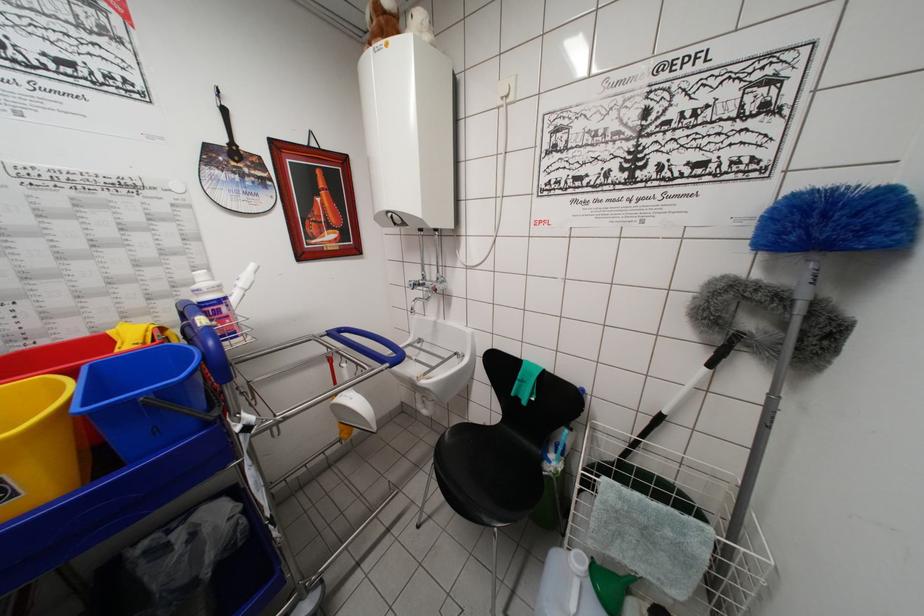
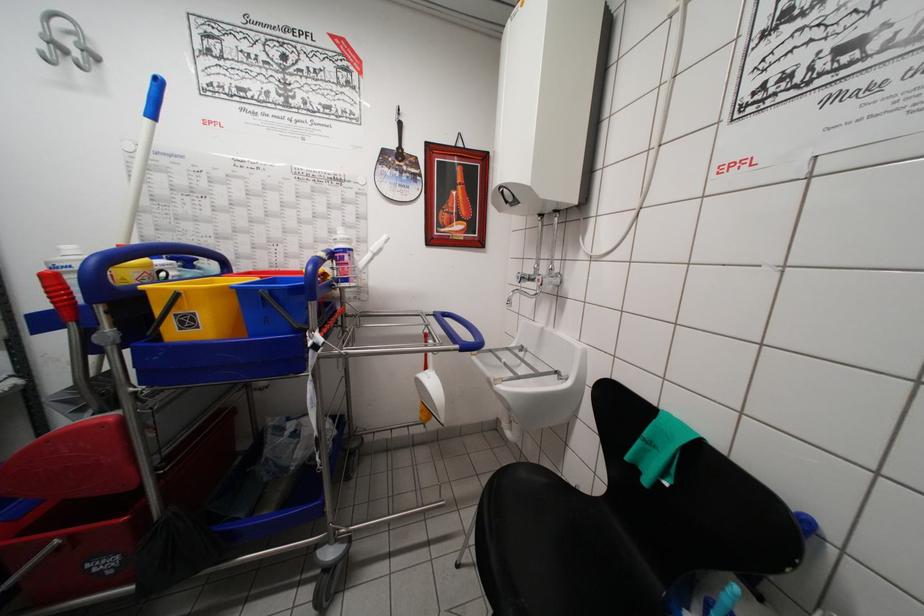
Question: The camera is either moving clockwise (left) or counter-clockwise (right) around the object. The first image is from the beginning of the video and the second image is from the end. Is the camera moving left or right when shooting the video?

Choices:
 (A) Left
 (B) Right

Answer: (B)